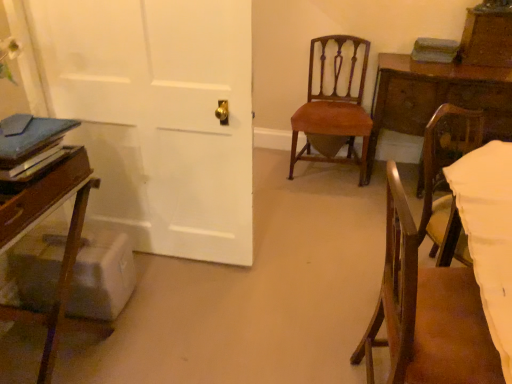
Image resolution: width=512 pixels, height=384 pixels. What do you see at coordinates (42, 194) in the screenshot?
I see `brown wood drawer at left` at bounding box center [42, 194].

Where is `velvet orange chair at center, the first chair when ordered from back to front`? This screenshot has height=384, width=512. velvet orange chair at center, the first chair when ordered from back to front is located at coordinates (333, 109).

This screenshot has width=512, height=384. What are the coordinates of `brown wood drawer at left` in the screenshot? It's located at (42, 194).

Is velvet orange chair at center, positioned as the 2th chair in right-to-left order, shorter than brown wood drawer at left?

Incorrect, the height of velvet orange chair at center, positioned as the 2th chair in right-to-left order, does not fall short of that of brown wood drawer at left.

Between velvet orange chair at center, positioned as the 2th chair in right-to-left order, and brown wood drawer at left, which one appears on the right side from the viewer's perspective?

velvet orange chair at center, positioned as the 2th chair in right-to-left order.

Does point (362, 118) appear closer or farther from the camera than point (4, 238)?

Point (362, 118).

Is velvet orange chair at center, the first chair when ordered from back to front, not within brown wood drawer at left?

Yes.

There is a wooden table at right. At what (x,y) coordinates should I click in order to perform the action: click on the 2nd chair above it (from a real-world perspective). Please return your answer as a coordinate pair (x, y). This screenshot has height=384, width=512. Looking at the image, I should click on (333, 109).

What's the angular difference between velvet orange chair at center, the first chair when ordered from back to front, and wooden table at right's facing directions?

There is a 0.0948-degree angle between the facing directions of velvet orange chair at center, the first chair when ordered from back to front, and wooden table at right.

In terms of height, does velvet orange chair at center, positioned as the 2th chair in right-to-left order, look taller or shorter compared to wooden table at right?

Considering their sizes, velvet orange chair at center, positioned as the 2th chair in right-to-left order, has more height than wooden table at right.

Would you consider brown wood drawer at left to be distant from wooden chair at left, positioned as the second chair in back-to-front order?

No, brown wood drawer at left is not far away from wooden chair at left, positioned as the second chair in back-to-front order.

How distant is brown wood drawer at left from wooden chair at left, the 3th chair viewed from the right?

brown wood drawer at left is 7.61 inches from wooden chair at left, the 3th chair viewed from the right.

From the picture: Who is shorter, brown wood drawer at left or wooden chair at left, the second chair in the front-to-back sequence?

With less height is brown wood drawer at left.

Which is more to the right, brown wood drawer at left or wooden chair at left, which is the 1th chair from left to right?

brown wood drawer at left is more to the right.

Is velvet orange chair at center, the first chair when ordered from back to front, to the right of wooden chair at left, the second chair in the front-to-back sequence, from the viewer's perspective?

Correct, you'll find velvet orange chair at center, the first chair when ordered from back to front, to the right of wooden chair at left, the second chair in the front-to-back sequence.

Based on the photo, which of these two, velvet orange chair at center, which ranks as the second chair in left-to-right order, or wooden chair at left, the 3th chair viewed from the right, is wider?

Wider between the two is wooden chair at left, the 3th chair viewed from the right.

Is wooden chair at left, positioned as the second chair in back-to-front order, inside velvet orange chair at center, which ranks as the second chair in left-to-right order?

No, wooden chair at left, positioned as the second chair in back-to-front order, is not inside velvet orange chair at center, which ranks as the second chair in left-to-right order.

Who is shorter, velvet orange chair at center, which ranks as the second chair in left-to-right order, or wooden chair at left, positioned as the second chair in back-to-front order?

With less height is wooden chair at left, positioned as the second chair in back-to-front order.

Consider the image. Is wooden chair at left, which is the 1th chair from left to right, smaller than velvet orange chair at center, arranged as the 3th chair when viewed from the front?

Actually, wooden chair at left, which is the 1th chair from left to right, might be larger than velvet orange chair at center, arranged as the 3th chair when viewed from the front.

Considering the sizes of objects wooden chair at left, which is the 1th chair from left to right, and velvet orange chair at center, arranged as the 3th chair when viewed from the front, in the image provided, who is shorter, wooden chair at left, which is the 1th chair from left to right, or velvet orange chair at center, arranged as the 3th chair when viewed from the front,?

Standing shorter between the two is wooden chair at left, which is the 1th chair from left to right.

Between wooden chair at left, positioned as the second chair in back-to-front order, and velvet orange chair at center, the first chair when ordered from back to front, which one appears on the right side from the viewer's perspective?

velvet orange chair at center, the first chair when ordered from back to front.

Is wooden chair at left, positioned as the second chair in back-to-front order, situated inside velvet orange chair at center, which ranks as the second chair in left-to-right order, or outside?

wooden chair at left, positioned as the second chair in back-to-front order, is located beyond the bounds of velvet orange chair at center, which ranks as the second chair in left-to-right order.

Which object is closer to the camera, wooden chair at lower right, which is the first chair in right-to-left order, or brown wood drawer at left?

wooden chair at lower right, which is the first chair in right-to-left order.

Is wooden chair at lower right, which is the first chair in right-to-left order, inside or outside of brown wood drawer at left?

wooden chair at lower right, which is the first chair in right-to-left order, is not inside brown wood drawer at left, it's outside.

Is point (475, 347) in front of point (55, 179)?

Yes, it is.

From a real-world perspective, who is located lower, wooden chair at left, the second chair in the front-to-back sequence, or wooden chair at lower right, marked as the 1th chair in a front-to-back arrangement?

In real-world perspective, wooden chair at left, the second chair in the front-to-back sequence, is lower.

From the image's perspective, does wooden chair at left, the 3th chair viewed from the right, appear higher than wooden chair at lower right, marked as the 1th chair in a front-to-back arrangement?

Yes.

Does wooden chair at left, positioned as the second chair in back-to-front order, appear on the left side of wooden chair at lower right, which is the first chair in right-to-left order?

Correct, you'll find wooden chair at left, positioned as the second chair in back-to-front order, to the left of wooden chair at lower right, which is the first chair in right-to-left order.

At what (x,y) coordinates should I click in order to perform the action: click on drawer that appears below the velvet orange chair at center, which ranks as the second chair in left-to-right order (from the image's perspective). Please return your answer as a coordinate pair (x, y). The width and height of the screenshot is (512, 384). Looking at the image, I should click on (42, 194).

In order to click on table in front of the velvet orange chair at center, the first chair when ordered from back to front in this screenshot , I will do `click(436, 97)`.

Based on their spatial positions, is wooden chair at lower right, the 3th chair viewed from the back, or wooden table at right closer to velvet orange chair at center, arranged as the 3th chair when viewed from the front?

Among the two, wooden table at right is located nearer to velvet orange chair at center, arranged as the 3th chair when viewed from the front.

Considering their positions, is wooden chair at lower right, the 3th chair viewed from the back, positioned closer to wooden table at right than velvet orange chair at center, positioned as the 2th chair in right-to-left order?

velvet orange chair at center, positioned as the 2th chair in right-to-left order, lies closer to wooden table at right than the other object.

When comparing their distances from velvet orange chair at center, positioned as the 2th chair in right-to-left order, does wooden table at right or brown wood drawer at left seem further?

brown wood drawer at left lies further to velvet orange chair at center, positioned as the 2th chair in right-to-left order, than the other object.

Estimate the real-world distances between objects in this image. Which object is further from wooden chair at left, the 3th chair viewed from the right, brown wood drawer at left or velvet orange chair at center, the first chair when ordered from back to front?

velvet orange chair at center, the first chair when ordered from back to front, is further to wooden chair at left, the 3th chair viewed from the right.

Looking at the image, which one is located closer to wooden table at right, wooden chair at left, which is the 1th chair from left to right, or velvet orange chair at center, the first chair when ordered from back to front?

Among the two, velvet orange chair at center, the first chair when ordered from back to front, is located nearer to wooden table at right.

From the image, which object appears to be nearer to velvet orange chair at center, arranged as the 3th chair when viewed from the front, wooden table at right or wooden chair at left, positioned as the second chair in back-to-front order?

Based on the image, wooden table at right appears to be nearer to velvet orange chair at center, arranged as the 3th chair when viewed from the front.

Estimate the real-world distances between objects in this image. Which object is closer to wooden chair at lower right, the 3th chair viewed from the back, wooden table at right or velvet orange chair at center, positioned as the 2th chair in right-to-left order?

Based on the image, wooden table at right appears to be nearer to wooden chair at lower right, the 3th chair viewed from the back.

Based on their spatial positions, is velvet orange chair at center, which ranks as the second chair in left-to-right order, or wooden chair at lower right, the 3th chair viewed from the back, further from wooden chair at left, the 3th chair viewed from the right?

velvet orange chair at center, which ranks as the second chair in left-to-right order, is further to wooden chair at left, the 3th chair viewed from the right.

Identify the location of chair positioned between wooden chair at lower right, which is the first chair in right-to-left order, and velvet orange chair at center, which ranks as the second chair in left-to-right order, from near to far. The width and height of the screenshot is (512, 384). (61, 294).

Locate an element on the screen. The width and height of the screenshot is (512, 384). drawer situated between wooden chair at left, positioned as the second chair in back-to-front order, and wooden chair at lower right, which is the first chair in right-to-left order, from left to right is located at coordinates (42, 194).

Identify the location of drawer between wooden chair at left, positioned as the second chair in back-to-front order, and wooden table at right from left to right. The image size is (512, 384). (42, 194).

The height and width of the screenshot is (384, 512). I want to click on drawer located between wooden chair at lower right, marked as the 1th chair in a front-to-back arrangement, and velvet orange chair at center, which ranks as the second chair in left-to-right order, in the depth direction, so click(42, 194).